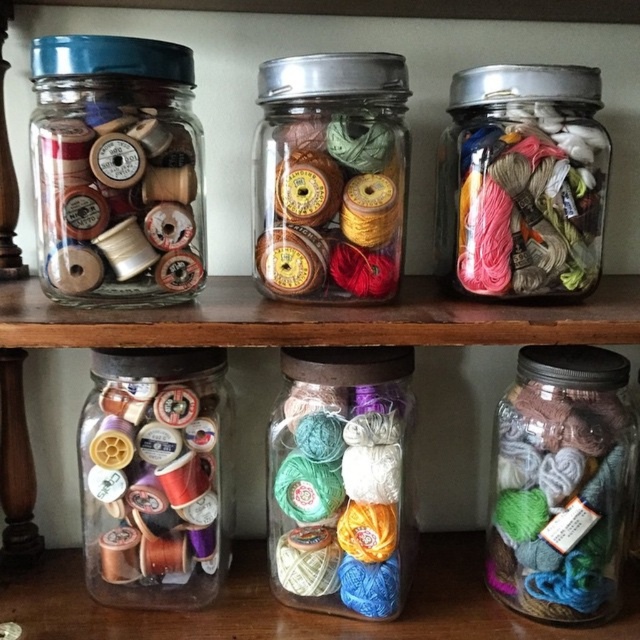
Who is shorter, matte glass yarn balls at center or matte brown spools at center?

matte brown spools at center is shorter.

How distant is matte glass yarn balls at center from matte brown spools at center?

The distance of matte glass yarn balls at center from matte brown spools at center is 6.59 inches.

This screenshot has width=640, height=640. What do you see at coordinates (340, 481) in the screenshot?
I see `matte glass yarn balls at center` at bounding box center [340, 481].

Find the location of `matte glass yarn balls at center`. matte glass yarn balls at center is located at coordinates click(x=340, y=481).

Based on the photo, does matte plastic spools at upper left have a greater height compared to matte brown spools at center?

Yes.

Can you confirm if matte plastic spools at upper left is positioned below matte brown spools at center?

Indeed, matte plastic spools at upper left is positioned under matte brown spools at center.

Does point (124, 44) lie in front of point (260, 198)?

Yes, it is in front of point (260, 198).

Locate an element on the screen. The height and width of the screenshot is (640, 640). matte plastic spools at upper left is located at coordinates pyautogui.click(x=116, y=170).

Which is more to the left, matte plastic spools at upper left or matte plastic spools at center?

Positioned to the left is matte plastic spools at center.

Who is more forward, (160, 204) or (154, 451)?

Point (160, 204) is more forward.

Where is `matte plastic spools at upper left`? This screenshot has width=640, height=640. matte plastic spools at upper left is located at coordinates (116, 170).